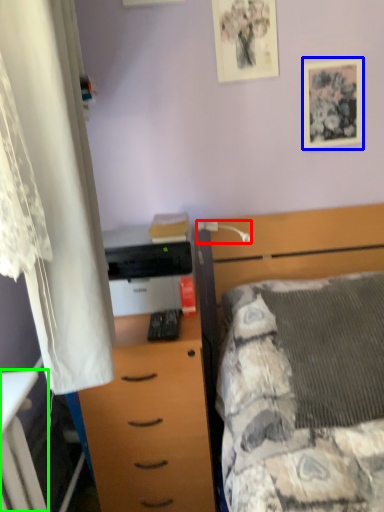
Question: Which object is the closest to the lamp (highlighted by a red box)? Choose among these: picture frame (highlighted by a blue box) or desk (highlighted by a green box).

Choices:
 (A) picture frame
 (B) desk

Answer: (A)